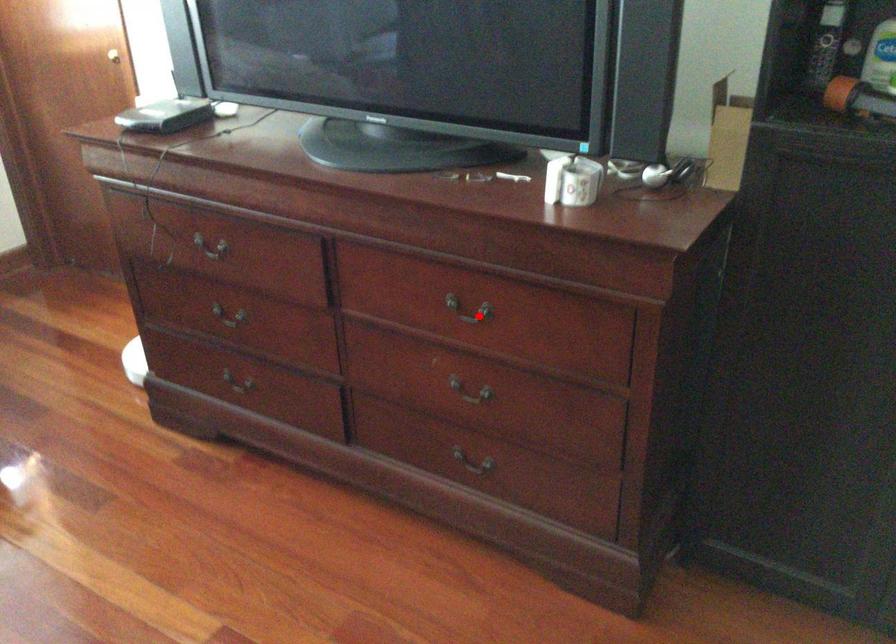
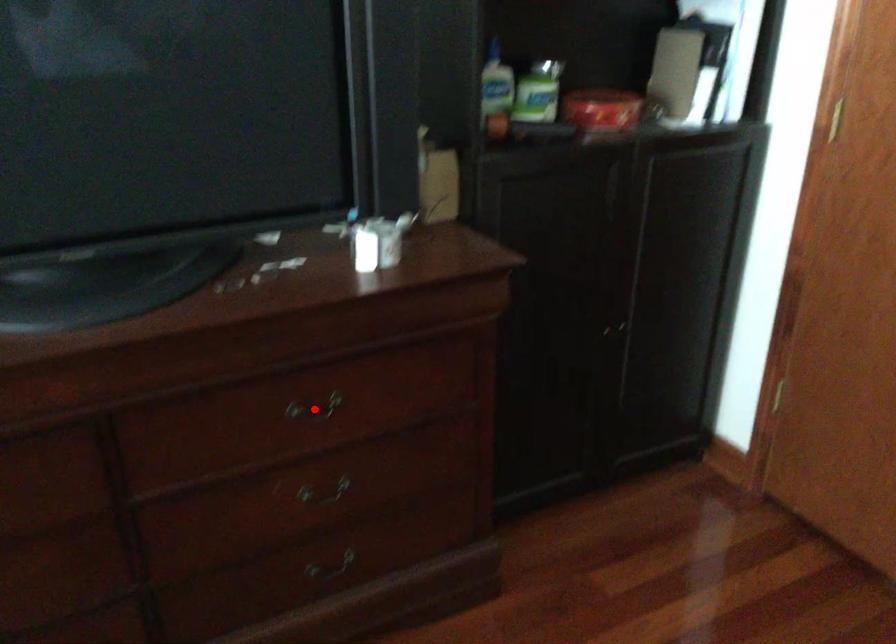
I am providing you with two images of the same scene from different viewpoints. A red point is marked on the first image and another point is marked on the second image. Is the red point in image1 aligned with the point shown in image2?

Yes